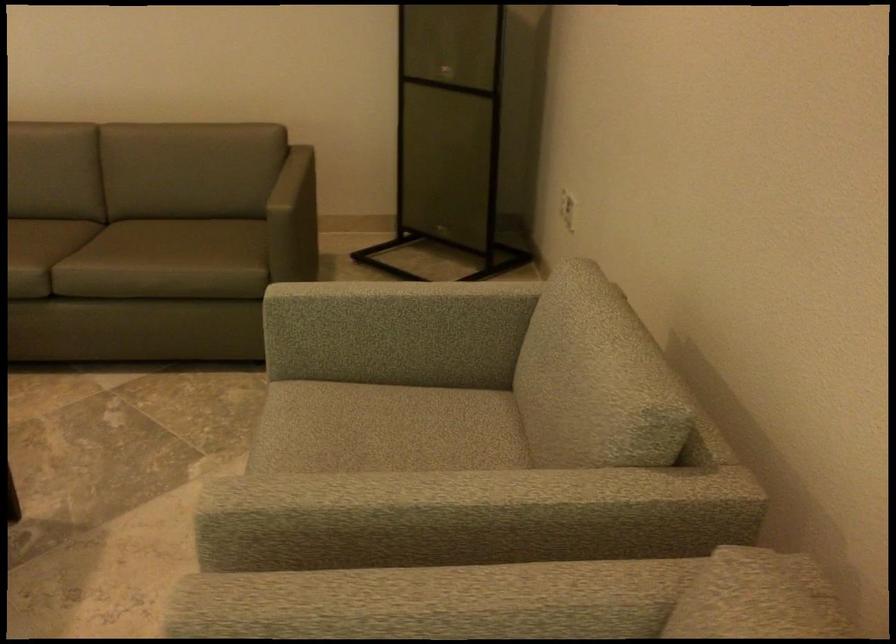
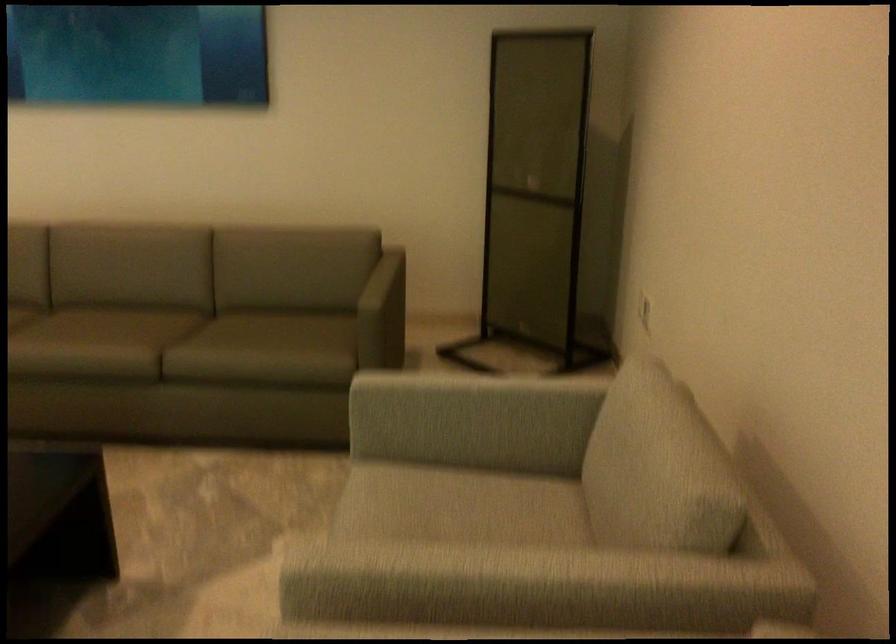
Where in the second image is the point corresponding to point 418,500 from the first image?

(479, 573)